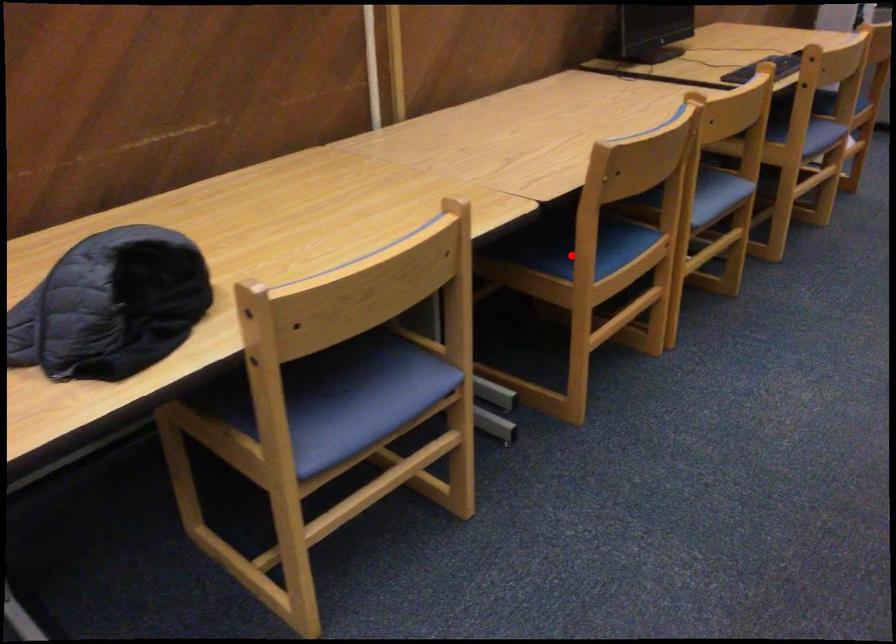
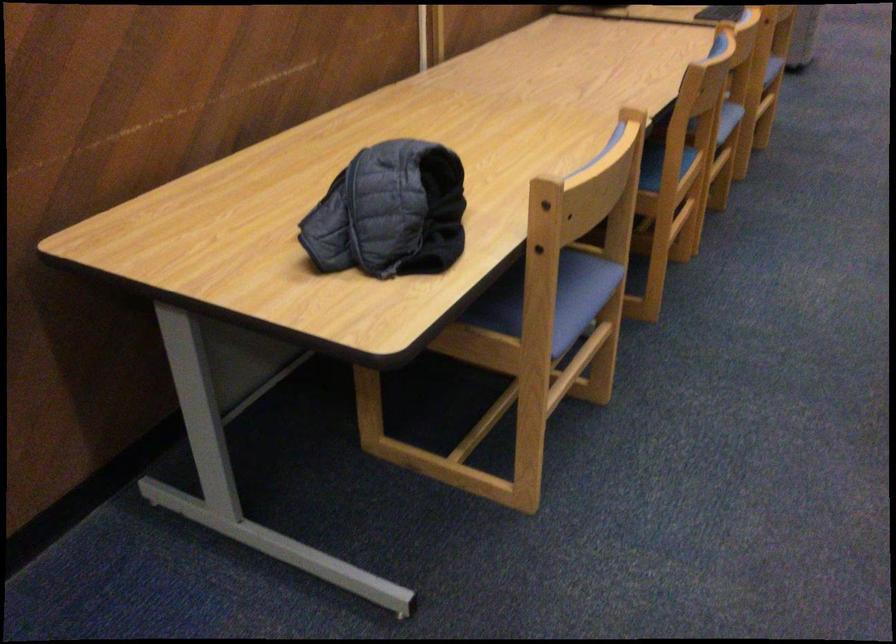
Question: I am providing you with two images of the same scene from different viewpoints. A red point is shown in image1. For the corresponding object point in image2, is it positioned nearer or farther from the camera?

Choices:
 (A) Nearer
 (B) Farther

Answer: (B)